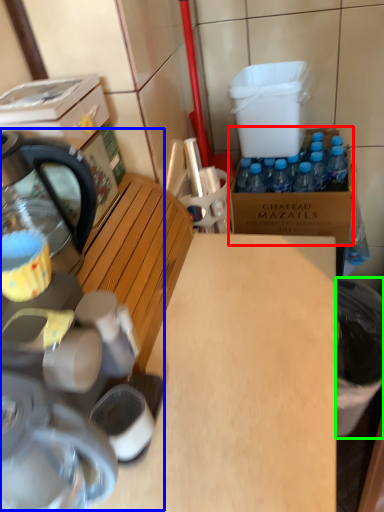
Question: Which is nearer to the cardboard box (highlighted by a red box)? coffee machine (highlighted by a blue box) or trash bin/can (highlighted by a green box).

Choices:
 (A) coffee machine
 (B) trash bin/can

Answer: (B)